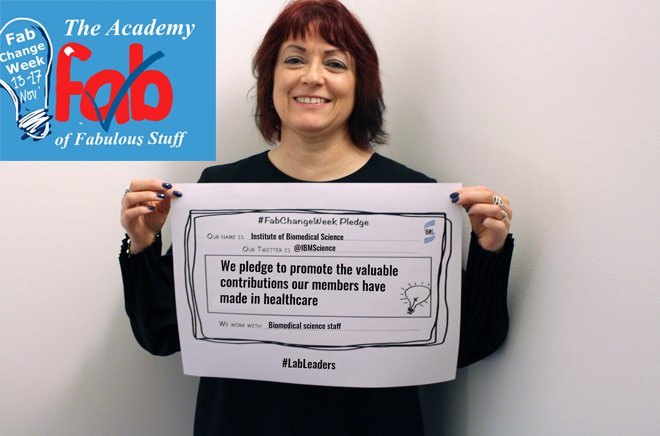
The width and height of the screenshot is (660, 436). I want to click on light bulb, so click(x=26, y=122).